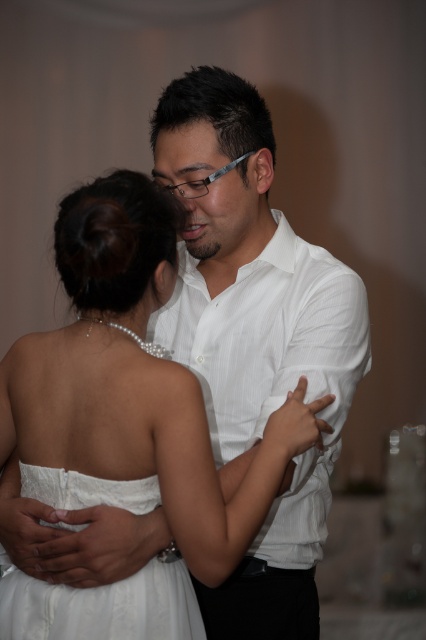
Which is more to the left, white satin dress at center or white lace dress at center?

white lace dress at center is more to the left.

Is point (147, 353) farther from viewer compared to point (66, 604)?

Yes, point (147, 353) is behind point (66, 604).

Identify the location of white satin dress at center. (134, 385).

Does white satin dress at center have a greater height compared to white smooth shirt at center?

No, white satin dress at center is not taller than white smooth shirt at center.

Does point (129, 275) come in front of point (313, 534)?

That is True.

Locate an element on the screen. white satin dress at center is located at coordinates (134, 385).

Does white smooth shirt at center appear on the right side of white lace dress at center?

Indeed, white smooth shirt at center is positioned on the right side of white lace dress at center.

Is point (244, 385) positioned in front of point (103, 604)?

No.

Image resolution: width=426 pixels, height=640 pixels. Find the location of `white smooth shirt at center`. white smooth shirt at center is located at coordinates (255, 337).